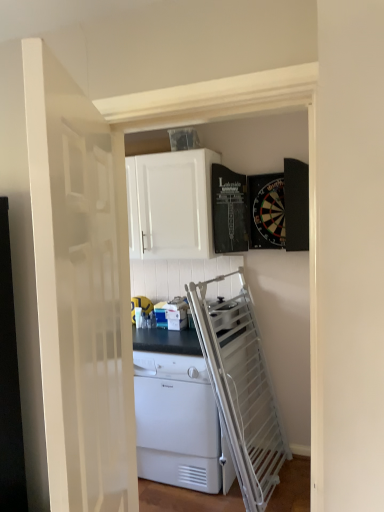
Identify the location of free space above yellow rubber ball at center (from a real-world perspective). (137, 297).